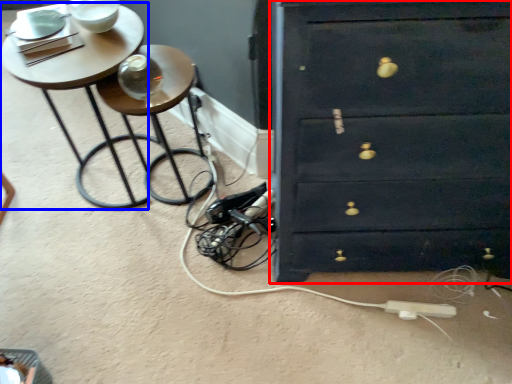
Question: Among these objects, which one is farthest to the camera, chest of drawers (highlighted by a red box) or table (highlighted by a blue box)?

Choices:
 (A) chest of drawers
 (B) table

Answer: (B)